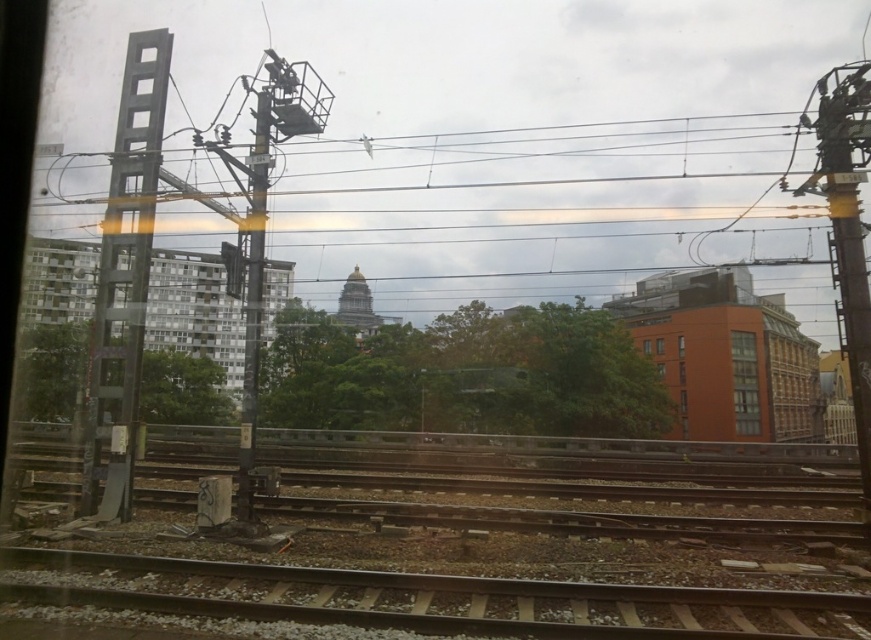
You are a passenger sitting at the window seat of the train and notice two points marked in the scene. Which point is closer to you, point (125, 218) or point (238, 472)?

Point (125, 218) is closer to the viewer than point (238, 472).